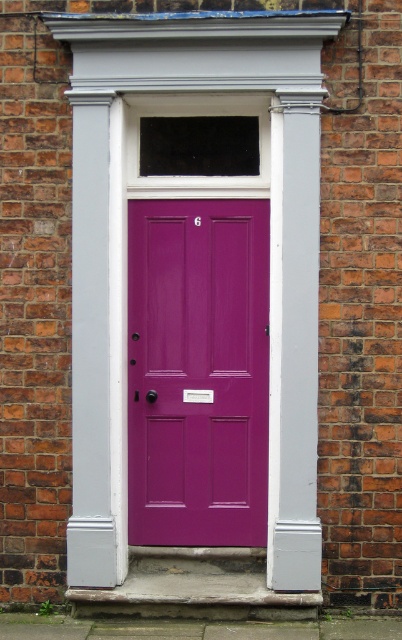
Question: Can you confirm if matte gray column at center is positioned below glossy purple door at center?

Choices:
 (A) yes
 (B) no

Answer: (B)

Question: Does matte gray column at center have a greater width compared to glossy purple door at center?

Choices:
 (A) yes
 (B) no

Answer: (A)

Question: Which object is closer to the camera taking this photo?

Choices:
 (A) matte gray column at center
 (B) glossy purple door at center

Answer: (A)

Question: Is matte gray column at center to the left of glossy purple door at center from the viewer's perspective?

Choices:
 (A) no
 (B) yes

Answer: (A)

Question: Which point is farther from the camera taking this photo?

Choices:
 (A) (157, 515)
 (B) (244, 36)

Answer: (A)

Question: Which object is closer to the camera taking this photo?

Choices:
 (A) matte gray column at center
 (B) glossy purple door at center

Answer: (A)